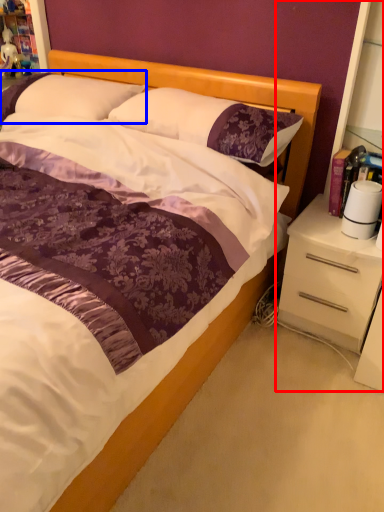
Question: Which object is closer to the camera taking this photo, dresser (highlighted by a red box) or pillow (highlighted by a blue box)?

Choices:
 (A) dresser
 (B) pillow

Answer: (A)